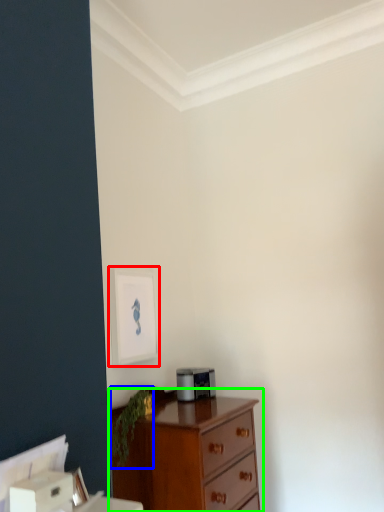
Question: Which object is positioned farthest from picture frame (highlighted by a red box)? Select from plant (highlighted by a blue box) and chest of drawers (highlighted by a green box).

Choices:
 (A) plant
 (B) chest of drawers

Answer: (B)